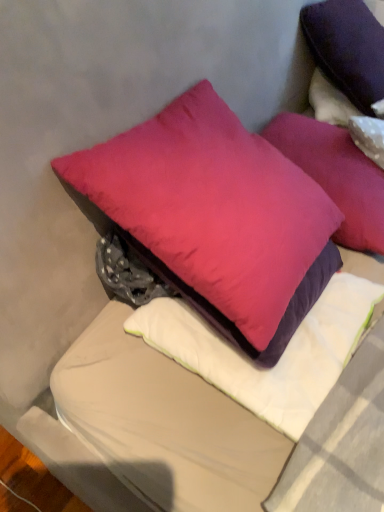
The height and width of the screenshot is (512, 384). Find the location of `vacant space situated above matte pink pillow at center, marked as the third pillow in a bottom-to-top arrangement (from a real-world perspective)`. vacant space situated above matte pink pillow at center, marked as the third pillow in a bottom-to-top arrangement (from a real-world perspective) is located at coordinates (332, 153).